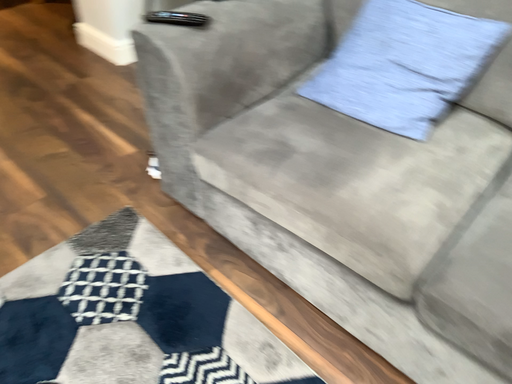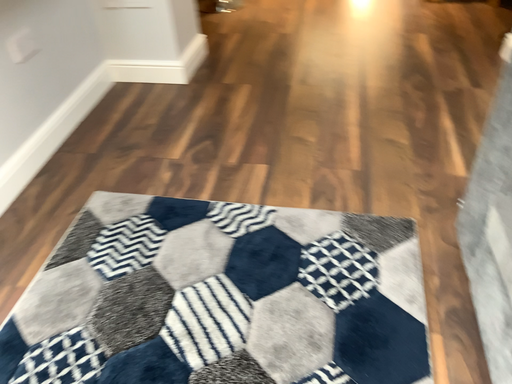
Question: How did the camera likely rotate when shooting the video?

Choices:
 (A) rotated downward
 (B) rotated upward

Answer: (B)